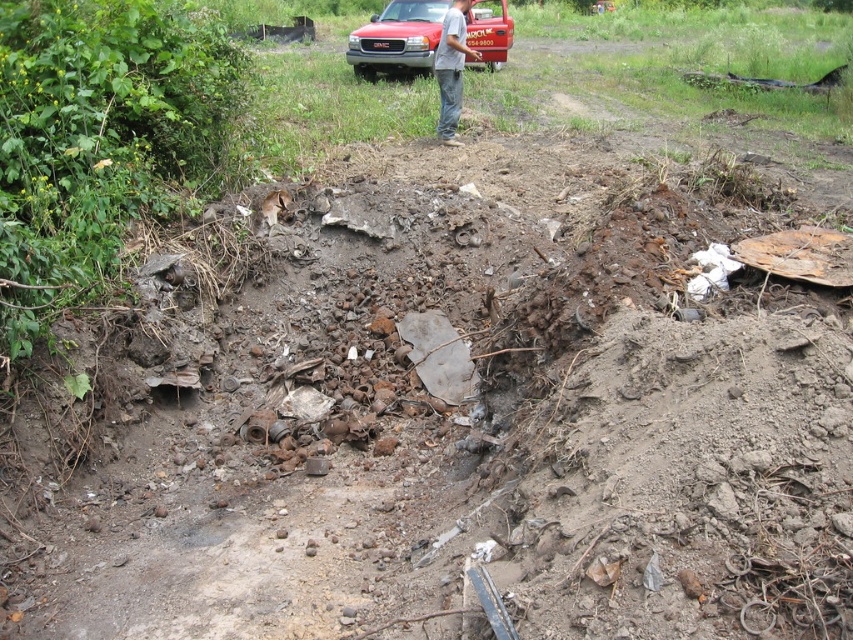
You are a construction worker standing at the edge of the excavation site. You need to place a 1.8 meters long plank between the matte red truck at upper center and the gray jeans at center. Can the plank fit horizontally between them?

The matte red truck at upper center is shorter than the gray jeans at center, so the vertical distance between them might be sufficient. However, the horizontal distance isn not specified in the objects description. Therefore, it is unclear if the 1.8 meters long plank can fit horizontally between them.

You are a construction worker who needs to retrieve your gray jeans at center from the excavation site. The matte red truck at upper center is blocking your path. Can you walk around the truck to reach your jeans?

The gray jeans at center is behind the matte red truck at upper center, so you can walk around the truck to reach your jeans.

You are standing at the origin point in the excavation site. The matte red truck at upper center is at coordinates 0.061, 0.467. If you need to move towards the truck, which direction should you head?

The matte red truck at upper center is located at coordinates (x=397, y=38). Since the x and y coordinates are both positive, you should move northeast to reach it.